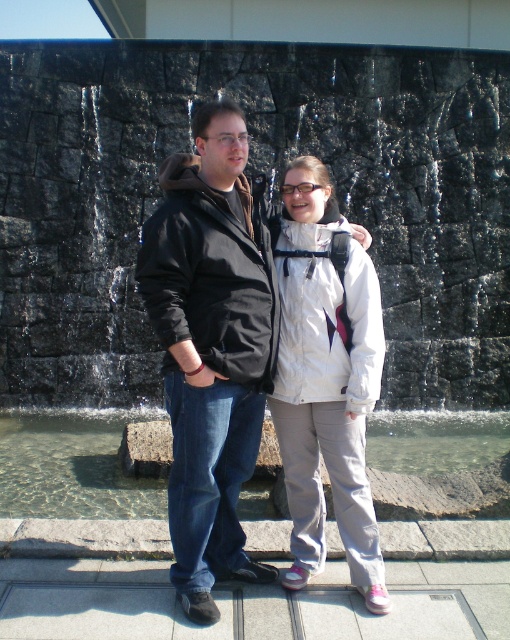
Based on the photo, you are standing in front of the stone wall with the two people. You see two points marked on the wall. The first point is at coordinate point[360,456] and the second point is at coordinate point[403,461]. Which point is closer to you?

Point[360,456] is in front of point[403,461], so it is closer to you.